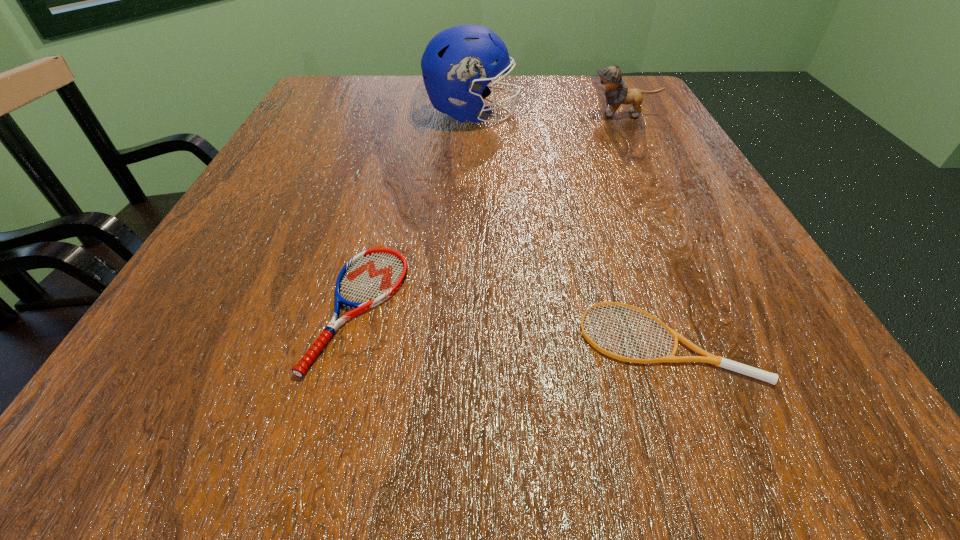
Where is `football helmet located at the far edge`? The image size is (960, 540). football helmet located at the far edge is located at coordinates (457, 63).

Locate an element on the screen. kitten at the far edge is located at coordinates (610, 79).

The width and height of the screenshot is (960, 540). Find the location of `object located in the near edge section of the desktop`. object located in the near edge section of the desktop is located at coordinates (705, 357).

Where is `kitten located at the right edge`? Image resolution: width=960 pixels, height=540 pixels. kitten located at the right edge is located at coordinates (610, 79).

The image size is (960, 540). In order to click on tennis racket positioned at the right edge in this screenshot , I will do `click(705, 357)`.

What are the coordinates of `object present at the far right corner` in the screenshot? It's located at (610, 79).

I want to click on object located in the near right corner section of the desktop, so click(705, 357).

The width and height of the screenshot is (960, 540). What are the coordinates of `vacant space at the far edge of the desktop` in the screenshot? It's located at (397, 92).

The image size is (960, 540). What are the coordinates of `free space at the left edge` in the screenshot? It's located at (x=275, y=227).

At what (x,y) coordinates should I click in order to perform the action: click on free space at the right edge. Please return your answer as a coordinate pair (x, y). This screenshot has height=540, width=960. Looking at the image, I should click on (624, 125).